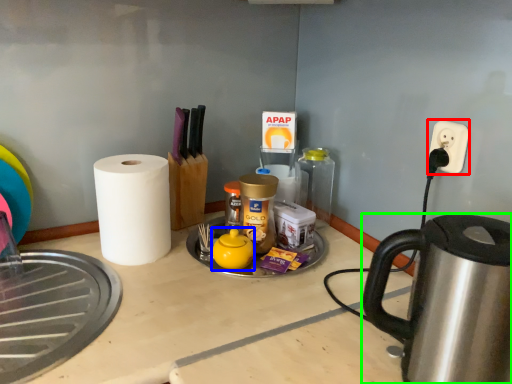
Question: Considering the real-world distances, which object is closest to electric outlet (highlighted by a red box)? tea pot (highlighted by a blue box) or kettle (highlighted by a green box).

Choices:
 (A) tea pot
 (B) kettle

Answer: (B)